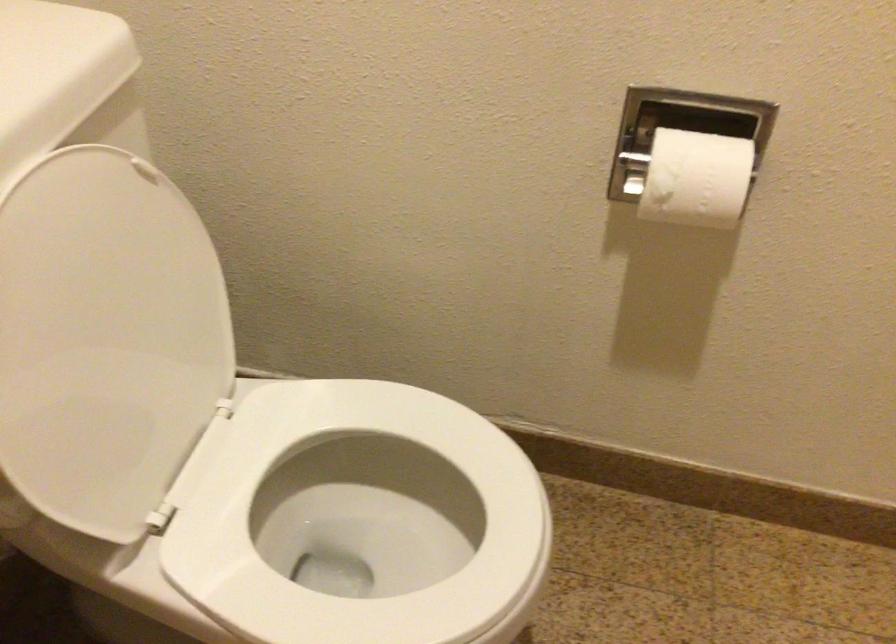
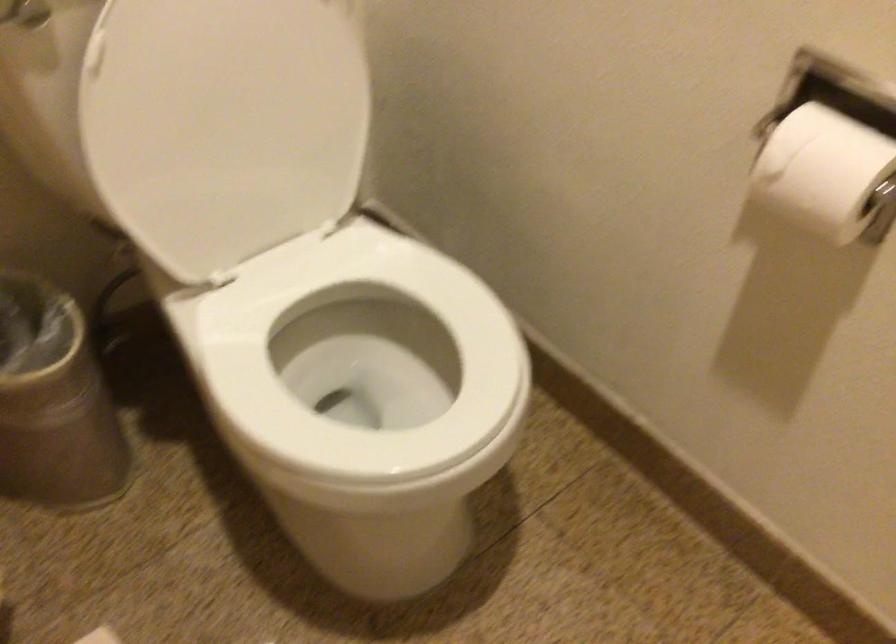
The point at (711, 175) is marked in the first image. Where is the corresponding point in the second image?

(824, 172)